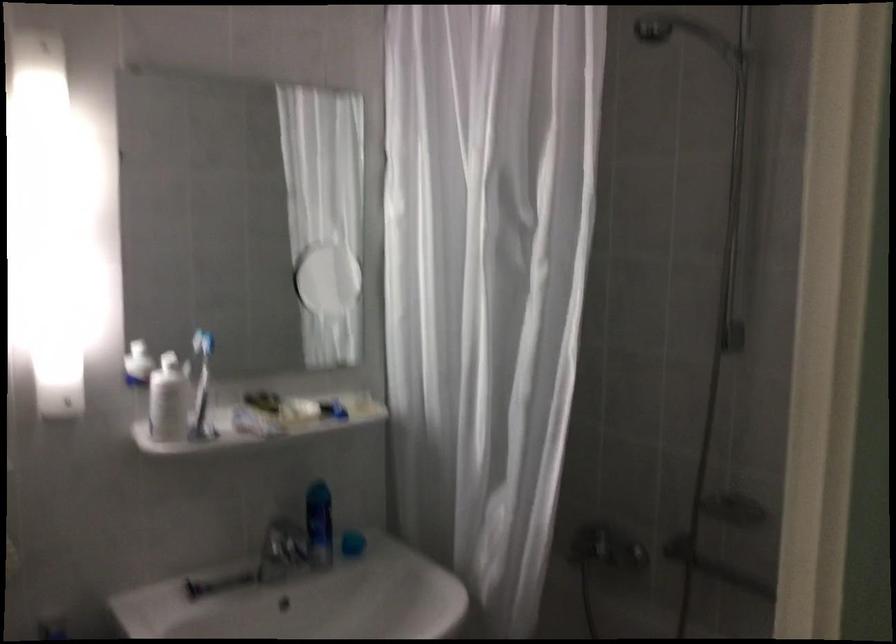
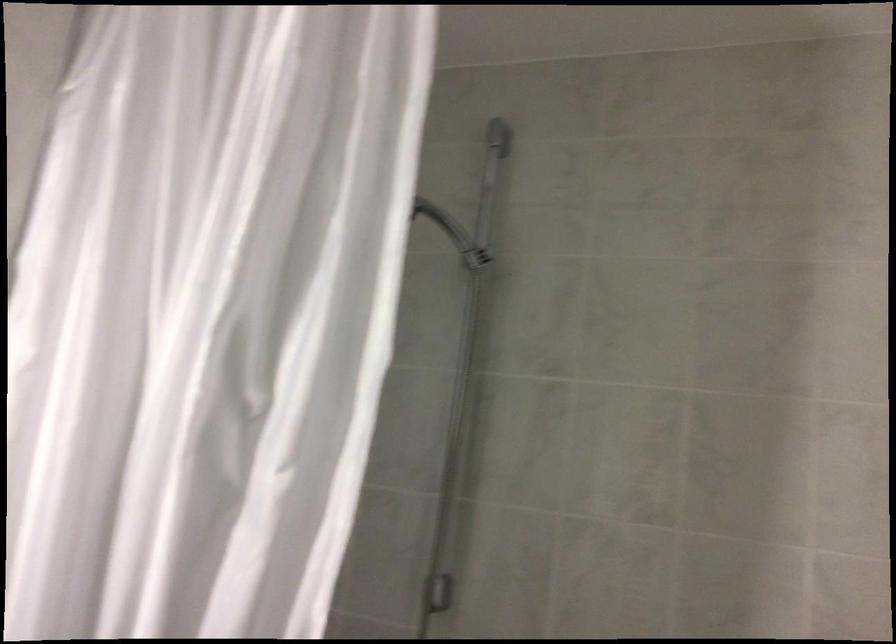
Based on the continuous images, in which direction is the camera rotating?

The rotation direction of the camera is right-up.